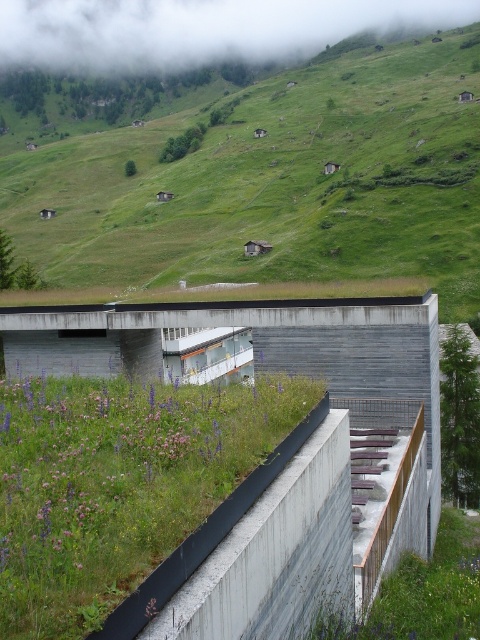
Can you confirm if green grassy hillside at upper center is bigger than green grass at center?

Correct, green grassy hillside at upper center is larger in size than green grass at center.

Does point (396, 108) come behind point (191, 480)?

That is True.

The height and width of the screenshot is (640, 480). I want to click on green grassy hillside at upper center, so click(276, 182).

Based on the photo, between green grass at center and white fluffy cloud at upper center, which one is positioned higher?

white fluffy cloud at upper center

Is green grass at center wider than white fluffy cloud at upper center?

No.

Identify the location of green grass at center. Image resolution: width=480 pixels, height=640 pixels. click(x=118, y=484).

Is green grassy hillside at upper center further to the viewer compared to white fluffy cloud at upper center?

No, it is not.

The height and width of the screenshot is (640, 480). I want to click on green grassy hillside at upper center, so click(276, 182).

This screenshot has width=480, height=640. I want to click on green grassy hillside at upper center, so click(276, 182).